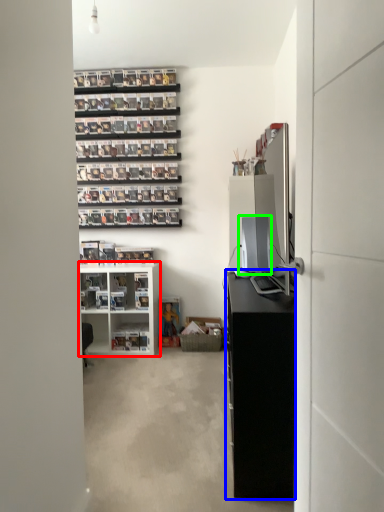
Question: Considering the real-world distances, which object is closest to shelf (highlighted by a red box)? cabinetry (highlighted by a blue box) or desktop computer (highlighted by a green box).

Choices:
 (A) cabinetry
 (B) desktop computer

Answer: (B)